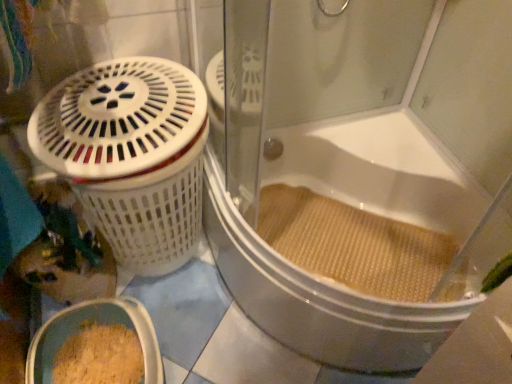
Question: Is beige textured mat at lower right to the left or to the right of white textured bathtub at center in the image?

Choices:
 (A) left
 (B) right

Answer: (A)

Question: In terms of height, does beige textured mat at lower right look taller or shorter compared to white textured bathtub at center?

Choices:
 (A) tall
 (B) short

Answer: (B)

Question: Estimate the real-world distances between objects in this image. Which object is closer to the beige textured mat at lower right?

Choices:
 (A) white plastic basket at left
 (B) white textured bathtub at center

Answer: (B)

Question: Based on their relative distances, which object is farther from the beige textured mat at lower right?

Choices:
 (A) white plastic basket at left
 (B) white textured bathtub at center

Answer: (A)